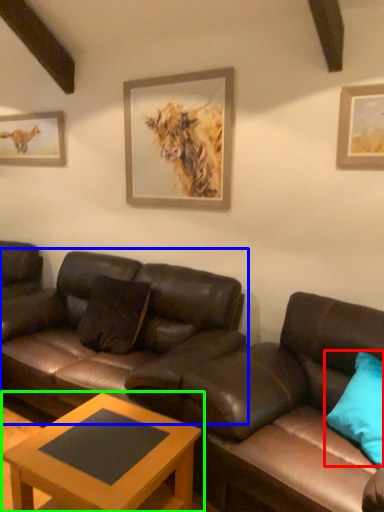
Question: Considering the real-world distances, which object is farthest from pillow (highlighted by a red box)? studio couch (highlighted by a blue box) or coffee table (highlighted by a green box)?

Choices:
 (A) studio couch
 (B) coffee table

Answer: (A)